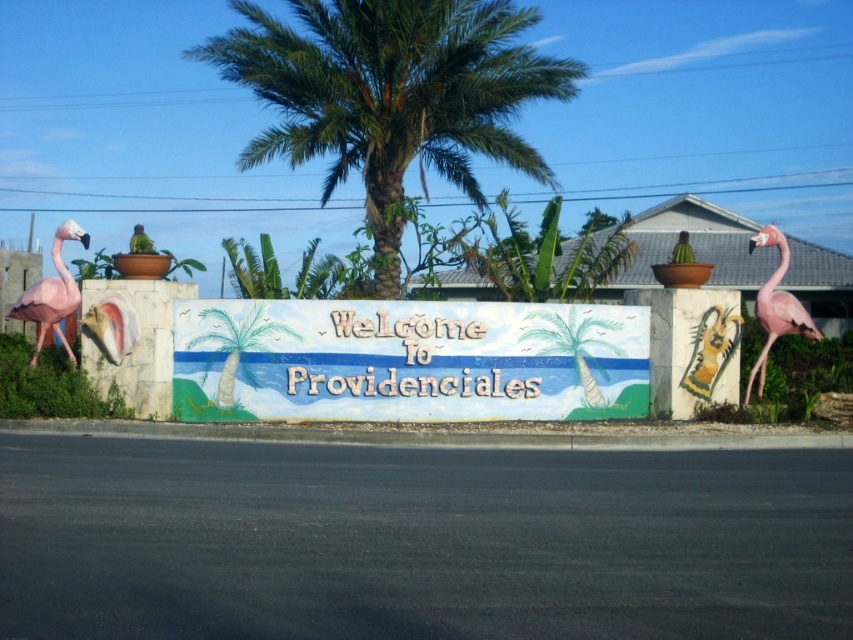
Question: Is green leafy palm tree at center thinner than pink matte flamingo at right?

Choices:
 (A) no
 (B) yes

Answer: (A)

Question: Is the position of painted wooden signboard at center more distant than that of pink matte flamingo at right?

Choices:
 (A) no
 (B) yes

Answer: (A)

Question: Which object appears farthest from the camera in this image?

Choices:
 (A) pink matte flamingo at right
 (B) painted wooden signboard at center

Answer: (A)

Question: Which object is positioned farthest from the green leafy palm tree at center?

Choices:
 (A) painted wooden signboard at center
 (B) pink matte flamingo at right

Answer: (A)

Question: Does pink matte flamingo at right appear on the right side of pink matte flamingo at left?

Choices:
 (A) yes
 (B) no

Answer: (A)

Question: Which of these objects is positioned closest to the painted wooden signboard at center?

Choices:
 (A) pink matte flamingo at left
 (B) green leafy palm tree at center
 (C) pink matte flamingo at right

Answer: (C)